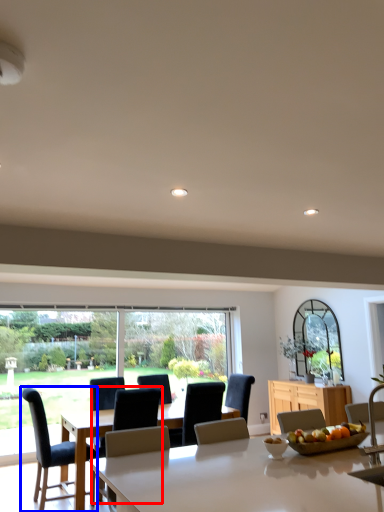
Question: Which object appears farthest to the camera in this image, chair (highlighted by a red box) or chair (highlighted by a blue box)?

Choices:
 (A) chair
 (B) chair

Answer: (B)